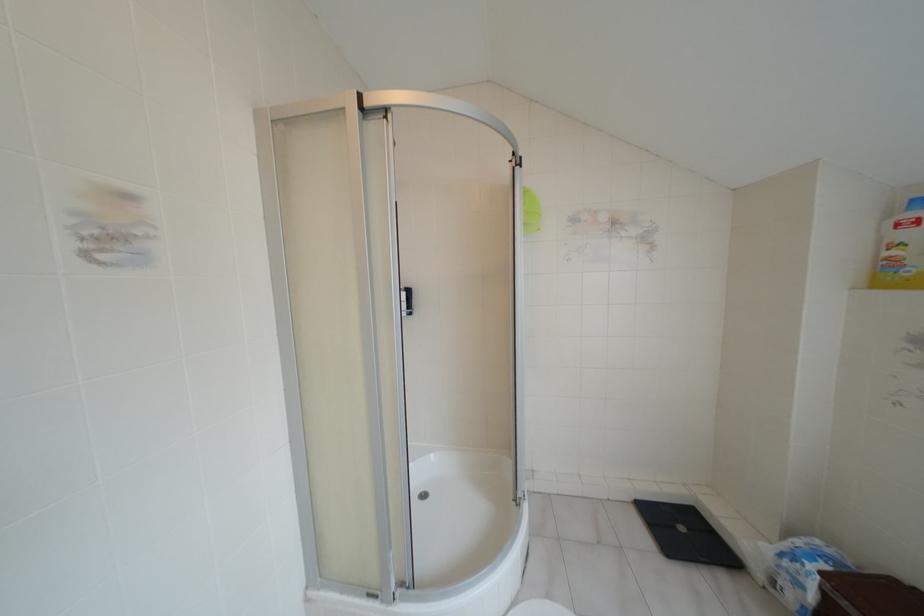
This screenshot has width=924, height=616. What are the coordinates of `white cleaner bottle` in the screenshot? It's located at (901, 249).